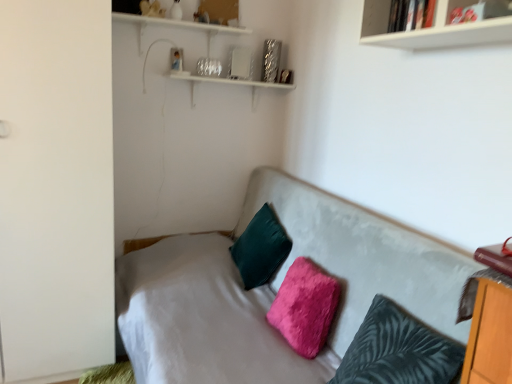
What is the approximate height of fuzzy pink pillow at center, placed as the second pillow when sorted from back to front?

fuzzy pink pillow at center, placed as the second pillow when sorted from back to front, is 17.04 inches tall.

Find the location of `velvet gray couch at center`. velvet gray couch at center is located at coordinates (275, 290).

Where is `velvet green pillow at center, which is the third pillow from front to back`? velvet green pillow at center, which is the third pillow from front to back is located at coordinates (261, 248).

Between fuzzy dark teal pillow at center, which is counted as the first pillow, starting from the front, and velvet green pillow at center, which is the 1th pillow in back-to-front order, which one appears on the right side from the viewer's perspective?

fuzzy dark teal pillow at center, which is counted as the first pillow, starting from the front, is more to the right.

In the scene shown: Can you confirm if fuzzy dark teal pillow at center, which is the 3th pillow from back to front, is wider than velvet green pillow at center, which is the third pillow from front to back?

In fact, fuzzy dark teal pillow at center, which is the 3th pillow from back to front, might be narrower than velvet green pillow at center, which is the third pillow from front to back.

Find the location of a particular element. pillow that is the 2nd one when counting upward from the fuzzy dark teal pillow at center, which is counted as the first pillow, starting from the front (from the image's perspective) is located at coordinates (261, 248).

Who is shorter, fuzzy dark teal pillow at center, which is the 3th pillow from back to front, or velvet green pillow at center, which is the 1th pillow in back-to-front order?

With less height is fuzzy dark teal pillow at center, which is the 3th pillow from back to front.

Is white matte wardrobe at left in contact with fuzzy pink pillow at center, placed as the second pillow when sorted from back to front?

No.

Does point (19, 166) come behind point (290, 276)?

No, (19, 166) is closer to viewer.

Between white matte wardrobe at left and fuzzy pink pillow at center, placed as the second pillow when sorted from back to front, which one is positioned behind?

fuzzy pink pillow at center, placed as the second pillow when sorted from back to front, is further from the camera.

Based on the photo, how many degrees apart are the facing directions of white matte wardrobe at left and fuzzy pink pillow at center, placed as the second pillow when sorted from back to front?

There is a 94.4-degree angle between the facing directions of white matte wardrobe at left and fuzzy pink pillow at center, placed as the second pillow when sorted from back to front.

Does white matte wardrobe at left have a smaller size compared to white glossy bookshelf at upper right?

Actually, white matte wardrobe at left might be larger than white glossy bookshelf at upper right.

In the scene shown: Is white matte wardrobe at left far away from white glossy bookshelf at upper right?

Yes, white matte wardrobe at left is far from white glossy bookshelf at upper right.

Between white matte wardrobe at left and white glossy bookshelf at upper right, which one is positioned in front?

white glossy bookshelf at upper right is in front.

From the image's perspective, which one is positioned higher, white matte wardrobe at left or white glossy bookshelf at upper right?

From the image's view, white glossy bookshelf at upper right is above.

Is velvet green pillow at center, which is the 1th pillow in back-to-front order, smaller than fuzzy pink pillow at center, placed as the second pillow when sorted from back to front?

Actually, velvet green pillow at center, which is the 1th pillow in back-to-front order, might be larger than fuzzy pink pillow at center, placed as the second pillow when sorted from back to front.

From the image's perspective, is velvet green pillow at center, which is the 1th pillow in back-to-front order, above fuzzy pink pillow at center, marked as the second pillow in a front-to-back arrangement?

Yes, from the image's perspective, velvet green pillow at center, which is the 1th pillow in back-to-front order, is above fuzzy pink pillow at center, marked as the second pillow in a front-to-back arrangement.

Is point (268, 247) farther from camera compared to point (323, 336)?

Yes, it is behind point (323, 336).

Is velvet gray couch at center not within white matte wardrobe at left?

Indeed, velvet gray couch at center is completely outside white matte wardrobe at left.

Is velvet gray couch at center in front of or behind white matte wardrobe at left in the image?

velvet gray couch at center is in front of white matte wardrobe at left.

Between velvet gray couch at center and white matte wardrobe at left, which one has less height?

velvet gray couch at center is shorter.

Is white glossy bookshelf at upper right positioned with its back to fuzzy pink pillow at center, marked as the second pillow in a front-to-back arrangement?

white glossy bookshelf at upper right is not turned away from fuzzy pink pillow at center, marked as the second pillow in a front-to-back arrangement.

In the scene shown: Would you say fuzzy pink pillow at center, placed as the second pillow when sorted from back to front, is part of white glossy bookshelf at upper right's contents?

No, fuzzy pink pillow at center, placed as the second pillow when sorted from back to front, is not surrounded by white glossy bookshelf at upper right.

Considering the relative sizes of white glossy bookshelf at upper right and fuzzy pink pillow at center, placed as the second pillow when sorted from back to front, in the image provided, is white glossy bookshelf at upper right wider than fuzzy pink pillow at center, placed as the second pillow when sorted from back to front,?

No.

This screenshot has height=384, width=512. I want to click on shelf above the fuzzy pink pillow at center, marked as the second pillow in a front-to-back arrangement (from a real-world perspective), so click(446, 33).

Is fuzzy pink pillow at center, marked as the second pillow in a front-to-back arrangement, taller or shorter than velvet gray couch at center?

In the image, fuzzy pink pillow at center, marked as the second pillow in a front-to-back arrangement, appears to be shorter than velvet gray couch at center.

Based on their sizes in the image, would you say fuzzy pink pillow at center, marked as the second pillow in a front-to-back arrangement, is bigger or smaller than velvet gray couch at center?

In the image, fuzzy pink pillow at center, marked as the second pillow in a front-to-back arrangement, appears to be smaller than velvet gray couch at center.

Are fuzzy pink pillow at center, marked as the second pillow in a front-to-back arrangement, and velvet gray couch at center beside each other?

There is a gap between fuzzy pink pillow at center, marked as the second pillow in a front-to-back arrangement, and velvet gray couch at center.

Is point (298, 331) closer or farther from the camera than point (361, 230)?

Point (298, 331) is positioned closer to the camera compared to point (361, 230).

Where is `pillow above the fuzzy dark teal pillow at center, which is counted as the first pillow, starting from the front (from a real-world perspective)`? The image size is (512, 384). pillow above the fuzzy dark teal pillow at center, which is counted as the first pillow, starting from the front (from a real-world perspective) is located at coordinates (261, 248).

Locate an element on the screen. The image size is (512, 384). the 1st pillow behind the white matte wardrobe at left is located at coordinates (305, 307).

Considering their positions, is white glossy bookshelf at upper right positioned closer to fuzzy pink pillow at center, placed as the second pillow when sorted from back to front, than white matte wardrobe at left?

white matte wardrobe at left is closer to fuzzy pink pillow at center, placed as the second pillow when sorted from back to front.

Based on the photo, considering their positions, is white glossy bookshelf at upper right positioned closer to fuzzy pink pillow at center, placed as the second pillow when sorted from back to front, than velvet gray couch at center?

The object closer to fuzzy pink pillow at center, placed as the second pillow when sorted from back to front, is velvet gray couch at center.

Which object lies further to the anchor point fuzzy dark teal pillow at center, which is the 3th pillow from back to front, fuzzy pink pillow at center, placed as the second pillow when sorted from back to front, or velvet gray couch at center?

Based on the image, velvet gray couch at center appears to be further to fuzzy dark teal pillow at center, which is the 3th pillow from back to front.

Which object lies nearer to the anchor point velvet gray couch at center, fuzzy pink pillow at center, placed as the second pillow when sorted from back to front, or white glossy bookshelf at upper right?

Among the two, fuzzy pink pillow at center, placed as the second pillow when sorted from back to front, is located nearer to velvet gray couch at center.

When comparing their distances from velvet green pillow at center, which is the third pillow from front to back, does fuzzy dark teal pillow at center, which is counted as the first pillow, starting from the front, or white matte wardrobe at left seem closer?

fuzzy dark teal pillow at center, which is counted as the first pillow, starting from the front, lies closer to velvet green pillow at center, which is the third pillow from front to back, than the other object.

Which object lies further to the anchor point fuzzy pink pillow at center, marked as the second pillow in a front-to-back arrangement, white matte wardrobe at left or velvet gray couch at center?

The object further to fuzzy pink pillow at center, marked as the second pillow in a front-to-back arrangement, is white matte wardrobe at left.

Estimate the real-world distances between objects in this image. Which object is further from white glossy bookshelf at upper right, fuzzy pink pillow at center, marked as the second pillow in a front-to-back arrangement, or fuzzy dark teal pillow at center, which is the 3th pillow from back to front?

fuzzy pink pillow at center, marked as the second pillow in a front-to-back arrangement, is further to white glossy bookshelf at upper right.

Consider the image. Based on their spatial positions, is fuzzy dark teal pillow at center, which is counted as the first pillow, starting from the front, or velvet green pillow at center, which is the 1th pillow in back-to-front order, further from white matte wardrobe at left?

The object further to white matte wardrobe at left is fuzzy dark teal pillow at center, which is counted as the first pillow, starting from the front.

At what (x,y) coordinates should I click in order to perform the action: click on shelf between velvet gray couch at center and velvet green pillow at center, which is the third pillow from front to back, from front to back. Please return your answer as a coordinate pair (x, y). This screenshot has height=384, width=512. Looking at the image, I should click on (446, 33).

Locate an element on the screen. This screenshot has height=384, width=512. studio couch between white glossy bookshelf at upper right and fuzzy dark teal pillow at center, which is the 3th pillow from back to front, from top to bottom is located at coordinates (275, 290).

Find the location of a particular element. The image size is (512, 384). pillow between velvet gray couch at center and fuzzy pink pillow at center, marked as the second pillow in a front-to-back arrangement, along the z-axis is located at coordinates (398, 350).

I want to click on studio couch between white matte wardrobe at left and white glossy bookshelf at upper right in the horizontal direction, so click(275, 290).